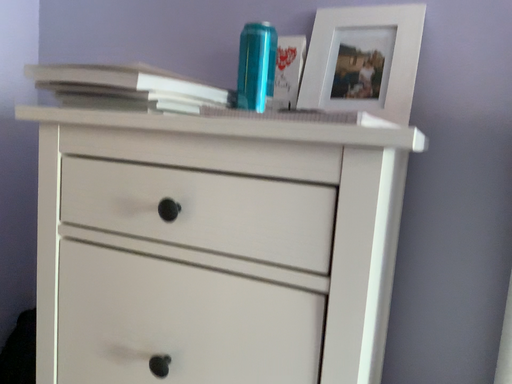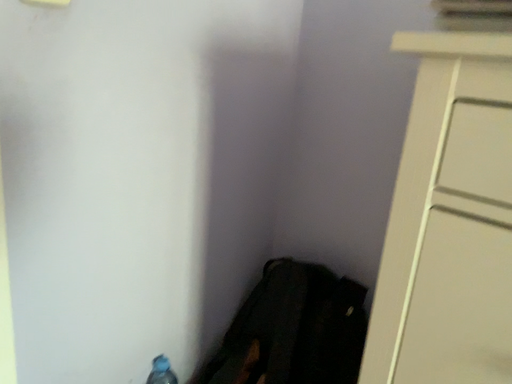
Question: How did the camera likely rotate when shooting the video?

Choices:
 (A) rotated upward
 (B) rotated downward

Answer: (B)